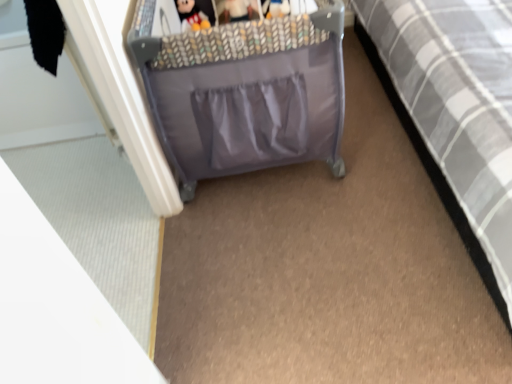
Question: Is gray fabric bed at right to the right of plush fabric plushie at upper center from the viewer's perspective?

Choices:
 (A) yes
 (B) no

Answer: (A)

Question: From the image's perspective, is gray fabric bed at right under plush fabric plushie at upper center?

Choices:
 (A) yes
 (B) no

Answer: (A)

Question: Is gray fabric bed at right smaller than plush fabric plushie at upper center?

Choices:
 (A) no
 (B) yes

Answer: (A)

Question: From the image's perspective, is gray fabric bed at right on top of plush fabric plushie at upper center?

Choices:
 (A) no
 (B) yes

Answer: (A)

Question: From a real-world perspective, does gray fabric bed at right stand above plush fabric plushie at upper center?

Choices:
 (A) no
 (B) yes

Answer: (B)

Question: Would you say gray fabric bed at right is a long distance from plush fabric plushie at upper center?

Choices:
 (A) no
 (B) yes

Answer: (A)

Question: From a real-world perspective, is plush fabric plushie at upper center beneath gray fabric bed at right?

Choices:
 (A) yes
 (B) no

Answer: (A)

Question: Is gray fabric bed at right completely or partially inside plush fabric plushie at upper center?

Choices:
 (A) no
 (B) yes

Answer: (A)

Question: Does plush fabric plushie at upper center have a lesser height compared to gray fabric bed at right?

Choices:
 (A) no
 (B) yes

Answer: (B)

Question: Does plush fabric plushie at upper center turn towards gray fabric bed at right?

Choices:
 (A) yes
 (B) no

Answer: (B)

Question: Is the position of plush fabric plushie at upper center more distant than that of gray fabric bed at right?

Choices:
 (A) no
 (B) yes

Answer: (B)

Question: Would you consider plush fabric plushie at upper center to be distant from gray fabric bed at right?

Choices:
 (A) yes
 (B) no

Answer: (B)

Question: Looking at their shapes, would you say gray fabric bed at right is wider or thinner than plush fabric plushie at upper center?

Choices:
 (A) wide
 (B) thin

Answer: (A)